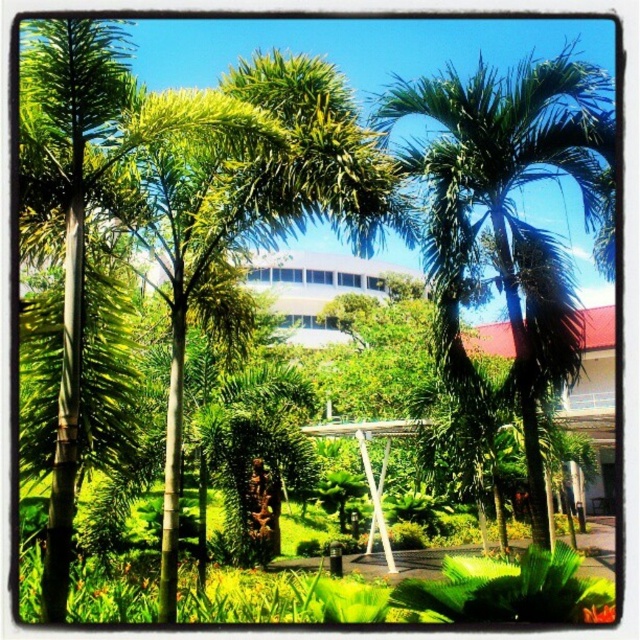
Is green leafy palm tree at center positioned in front of green leafy palm tree at left?

No, it is not.

Consider the image. Which is more to the left, green leafy palm tree at center or green leafy palm tree at left?

green leafy palm tree at left is more to the left.

Is point (602, 106) more distant than point (42, 243)?

Yes, it is behind point (42, 243).

Where is `green leafy palm tree at center`? green leafy palm tree at center is located at coordinates (508, 218).